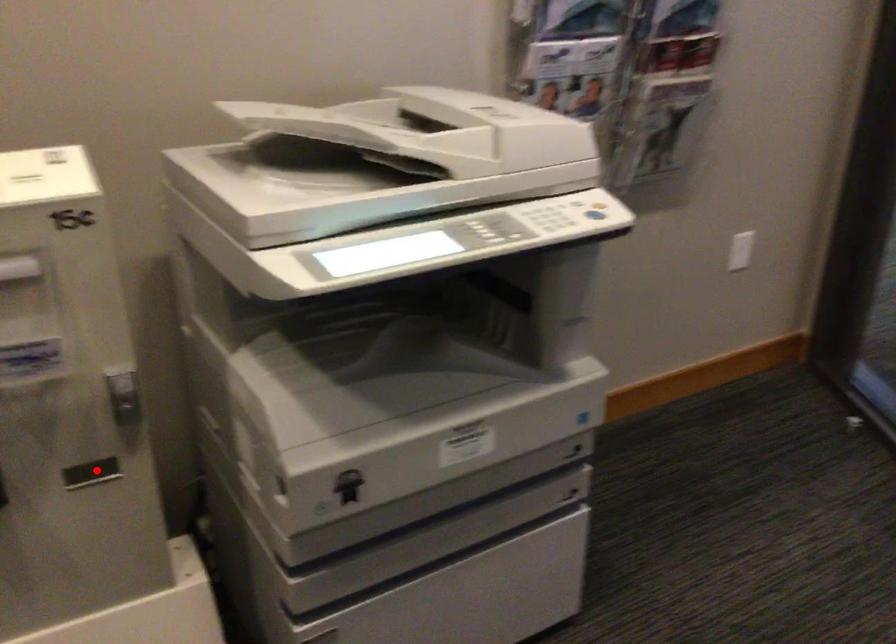
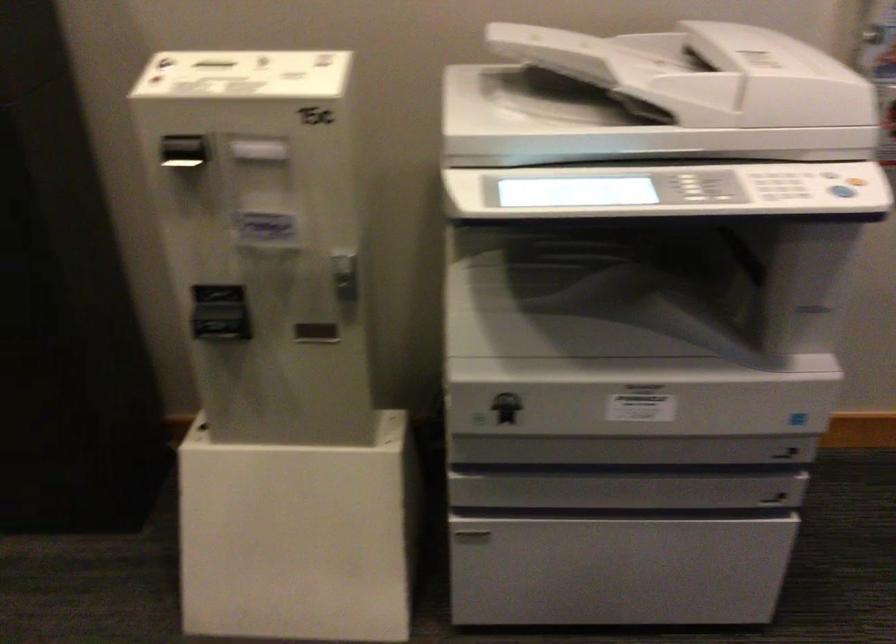
Where in the second image is the point corresponding to the highlighted location from the first image?

(315, 333)